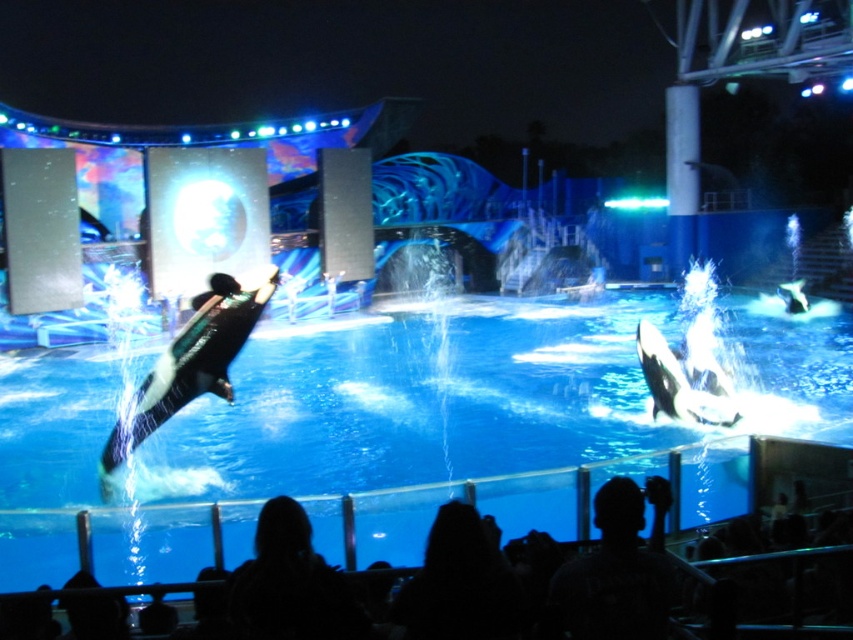
Who is taller, black smooth dolphin at center or black and white smooth orca at center?

With more height is black smooth dolphin at center.

Which is in front, point (172, 394) or point (688, 412)?

Point (172, 394) is in front.

This screenshot has height=640, width=853. Find the location of `black smooth dolphin at center`. black smooth dolphin at center is located at coordinates (189, 364).

Is dark hair at lower center wider than black smooth dolphin at center?

No.

This screenshot has height=640, width=853. I want to click on dark hair at lower center, so click(289, 582).

Locate an element on the screen. The height and width of the screenshot is (640, 853). dark hair at lower center is located at coordinates (289, 582).

Who is shorter, black matte orca at center or black smooth dolphin at center?

black matte orca at center

I want to click on black matte orca at center, so click(512, 580).

Where is `black matte orca at center`? black matte orca at center is located at coordinates (512, 580).